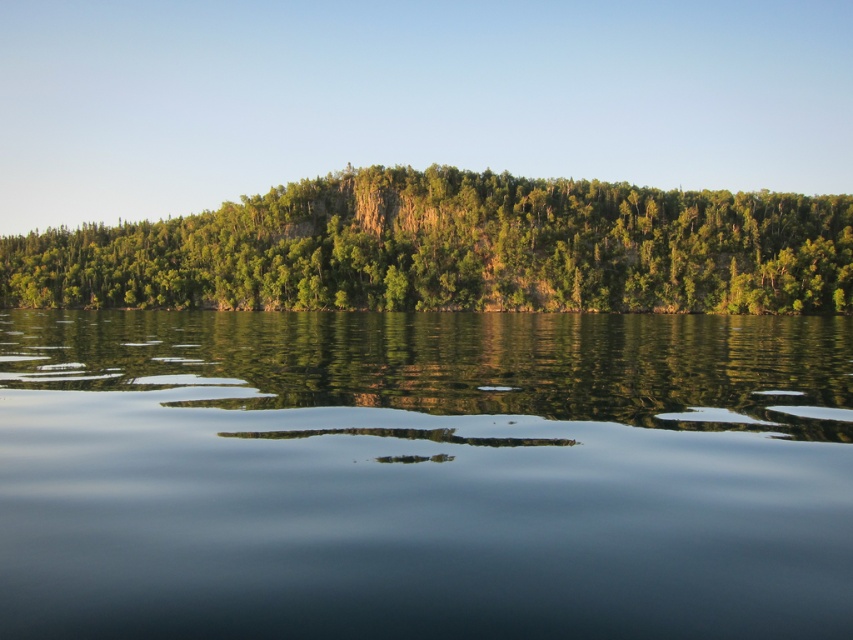
Question: Does smooth dark water at center have a lesser width compared to green leafy trees at center?

Choices:
 (A) no
 (B) yes

Answer: (B)

Question: Does smooth dark water at center appear on the left side of green leafy trees at center?

Choices:
 (A) yes
 (B) no

Answer: (B)

Question: Which of the following is the farthest from the observer?

Choices:
 (A) (461, 280)
 (B) (761, 532)

Answer: (A)

Question: Does smooth dark water at center come in front of green leafy trees at center?

Choices:
 (A) yes
 (B) no

Answer: (A)

Question: Which of the following is the farthest from the observer?

Choices:
 (A) (548, 276)
 (B) (782, 582)

Answer: (A)